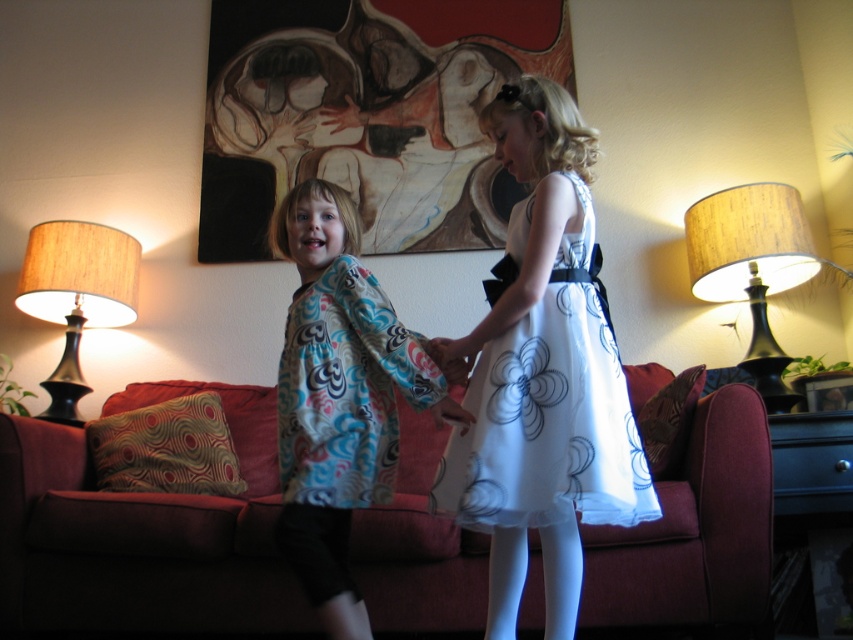
Question: Is black wood lampshade at right bigger than matte fabric hand at center?

Choices:
 (A) no
 (B) yes

Answer: (B)

Question: Which of these objects is positioned closest to the white satin dress at center?

Choices:
 (A) matte floral kimono at center
 (B) painted canvas at upper center
 (C) black wood lampshade at right

Answer: (A)

Question: Which object is positioned closest to the velvet red couch at center?

Choices:
 (A) matte floral kimono at center
 (B) black wood lampshade at right
 (C) matte fabric hand at center
 (D) white satin dress at center

Answer: (A)

Question: Is velvet red couch at center positioned in front of matte fabric hand at center?

Choices:
 (A) yes
 (B) no

Answer: (B)

Question: Does velvet red couch at center appear on the right side of black wood lampshade at right?

Choices:
 (A) no
 (B) yes

Answer: (A)

Question: Which object is farther from the camera taking this photo?

Choices:
 (A) matte black lampshade at left
 (B) white satin dress at center

Answer: (A)